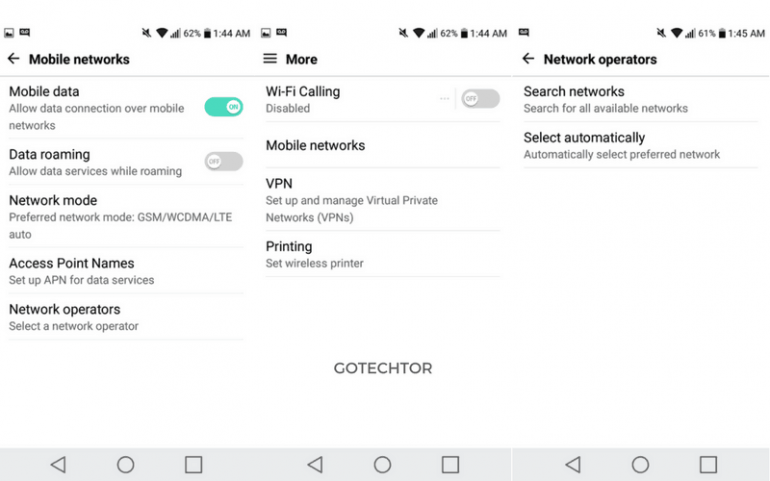
Identify the location of space to left of toggle switch. The image size is (770, 481). (456, 98), (199, 103), (201, 160).